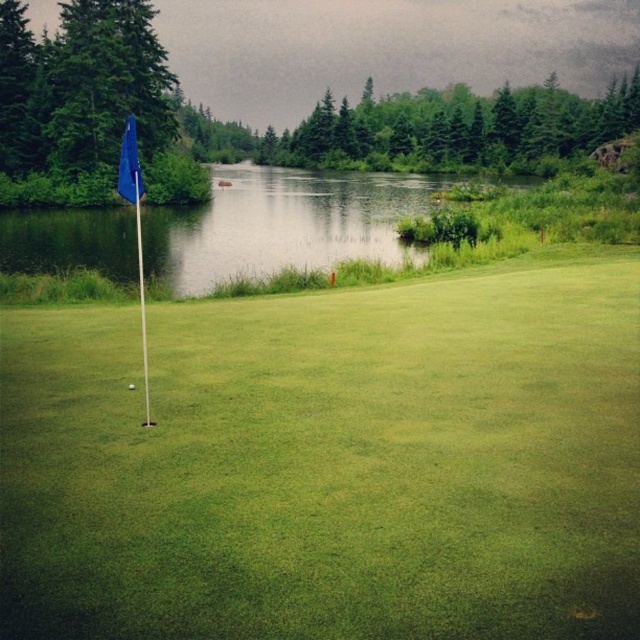
Is green grassy golf hole at center bigger than green grassy lake at left?

Actually, green grassy golf hole at center might be smaller than green grassy lake at left.

Is green grassy golf hole at center smaller than green grassy lake at left?

Yes.

Is point (104, 524) farther from camera compared to point (257, 260)?

That is False.

You are a GUI agent. You are given a task and a screenshot of the screen. Output one action in this format:
    pyautogui.click(x=<x>, y=<y>)
    Task: Click on the green grassy golf hole at center
    The width and height of the screenshot is (640, 640).
    Given the screenshot: What is the action you would take?
    pyautogui.click(x=330, y=461)

Consider the image. Is green grassy golf hole at center to the right of blue fabric flag at left from the viewer's perspective?

Indeed, green grassy golf hole at center is positioned on the right side of blue fabric flag at left.

Can you confirm if green grassy golf hole at center is positioned above blue fabric flag at left?

No.

Is point (545, 541) more distant than point (125, 166)?

No, it is in front of (125, 166).

Find the location of `green grassy golf hole at center`. green grassy golf hole at center is located at coordinates (330, 461).

Can you confirm if green grassy lake at left is shorter than blue fabric flag at left?

Incorrect, green grassy lake at left's height does not fall short of blue fabric flag at left's.

At what (x,y) coordinates should I click in order to perform the action: click on green grassy lake at left. Please return your answer as a coordinate pair (x, y). This screenshot has width=640, height=640. Looking at the image, I should click on (284, 225).

Locate an element on the screen. green grassy lake at left is located at coordinates (284, 225).